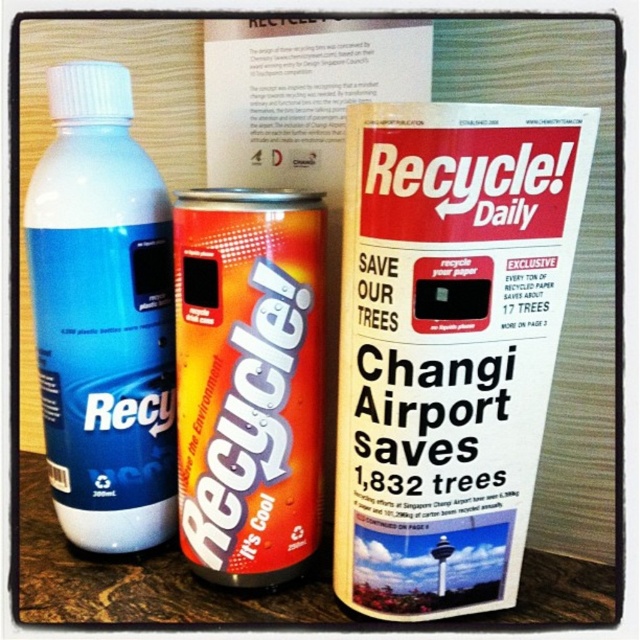
You are organizing a recycling drive and need to sort items based on their sizes. You have a blue matte bottle at left and an orange metallic can at center. Which item should you place first into the recycling bin if you want to start with the smaller item?

The blue matte bottle at left has a smaller size compared to the orange metallic can at center, so you should place the blue matte bottle at left first into the recycling bin.